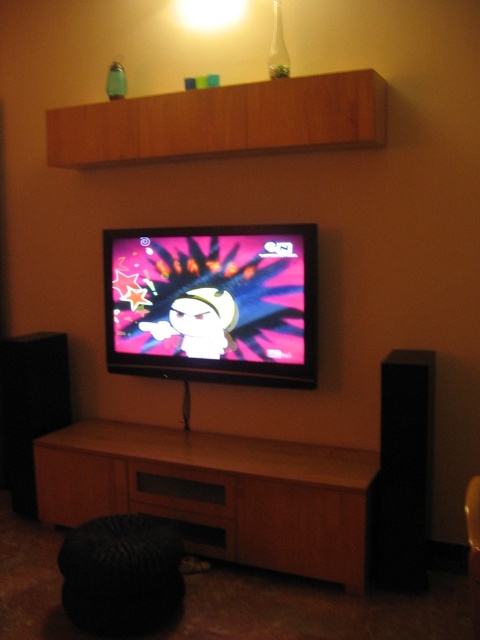
Does black knitted stool at lower left lie behind black matte speaker at right?

No, it is in front of black matte speaker at right.

Between black knitted stool at lower left and black matte speaker at right, which one has more height?

black matte speaker at right

Find the location of a particular element. The height and width of the screenshot is (640, 480). black knitted stool at lower left is located at coordinates (120, 573).

This screenshot has height=640, width=480. Describe the element at coordinates (405, 470) in the screenshot. I see `black matte speaker at right` at that location.

Image resolution: width=480 pixels, height=640 pixels. I want to click on black matte speaker at right, so click(405, 470).

Is point (238, 488) farther from viewer compared to point (157, 589)?

Yes, it is.

Is wooden cabinet at lower center thinner than black knitted stool at lower left?

No, wooden cabinet at lower center is not thinner than black knitted stool at lower left.

The height and width of the screenshot is (640, 480). What do you see at coordinates (216, 492) in the screenshot?
I see `wooden cabinet at lower center` at bounding box center [216, 492].

I want to click on wooden cabinet at lower center, so click(216, 492).